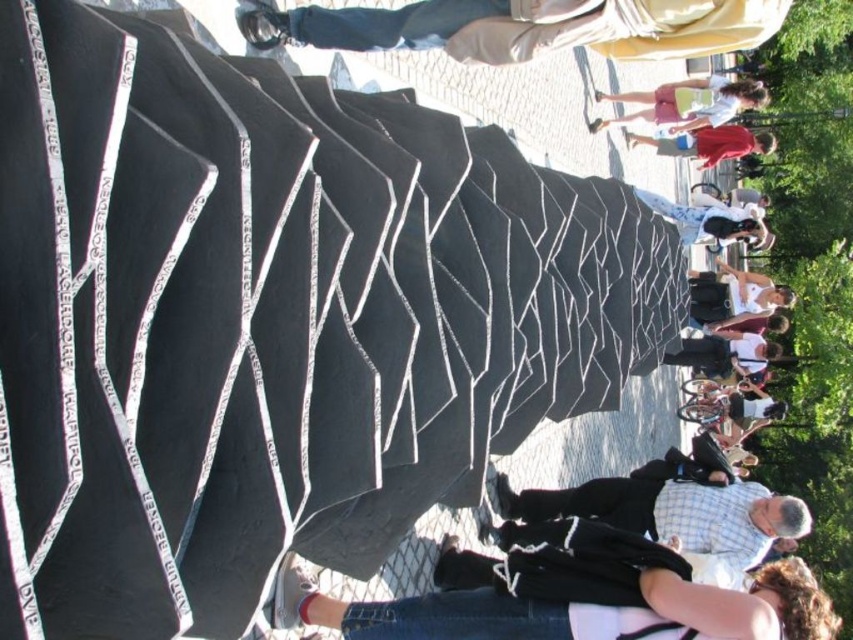
Locate an element on the screen. This screenshot has height=640, width=853. checkered shirt at center is located at coordinates (670, 513).

Does point (532, 516) come behind point (735, 145)?

No.

Between point (596, 483) and point (744, 150), which one is positioned behind?

Positioned behind is point (744, 150).

I want to click on checkered shirt at center, so click(670, 513).

Is checkered shirt at center above light pink shorts at upper right?

Incorrect, checkered shirt at center is not positioned above light pink shorts at upper right.

Between checkered shirt at center and light pink shorts at upper right, which one has less height?

With less height is checkered shirt at center.

Measure the distance between checkered shirt at center and camera.

They are 38.77 meters apart.

Identify the location of checkered shirt at center. The width and height of the screenshot is (853, 640). (670, 513).

Is light beige fabric at upper center positioned in front of checkered shirt at center?

Yes.

Describe the element at coordinates (526, 28) in the screenshot. I see `light beige fabric at upper center` at that location.

Identify the location of light beige fabric at upper center. Image resolution: width=853 pixels, height=640 pixels. (526, 28).